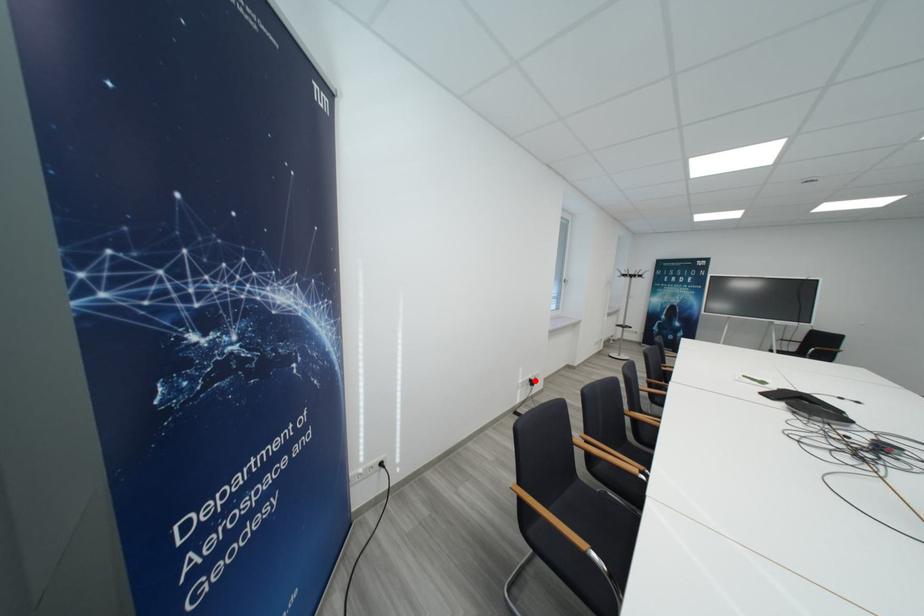
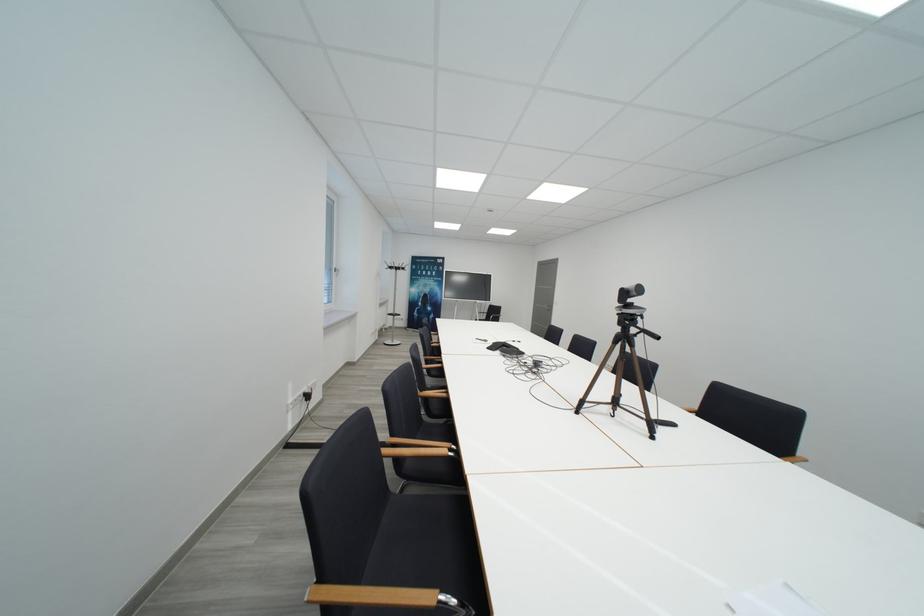
In the second image, find the point that corresponds to the highlighted location in the first image.

(309, 395)